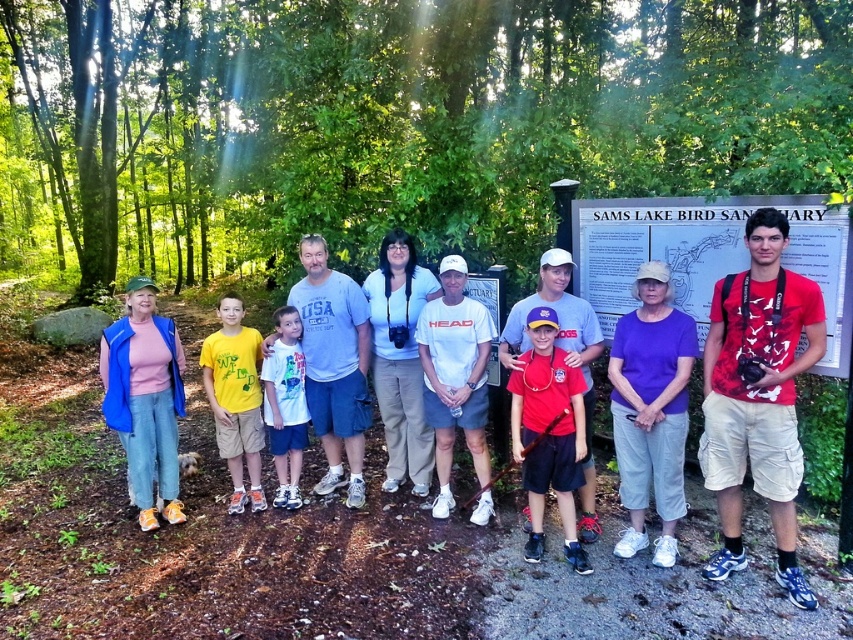
Is white paper sign at center above purple fabric cap at center?

Correct, white paper sign at center is located above purple fabric cap at center.

Is point (682, 298) less distant than point (561, 371)?

No, it is not.

At what (x,y) coordinates should I click in order to perform the action: click on white paper sign at center. Please return your answer as a coordinate pair (x, y). This screenshot has width=853, height=640. Looking at the image, I should click on (709, 256).

Who is shorter, yellow cotton shirt at center or white cotton shirt at center?

Standing shorter between the two is white cotton shirt at center.

Who is more forward, (252, 458) or (289, 342)?

Positioned in front is point (289, 342).

Locate an element on the screen. This screenshot has height=640, width=853. yellow cotton shirt at center is located at coordinates (235, 397).

What are the coordinates of `yellow cotton shirt at center` in the screenshot? It's located at (235, 397).

Which is in front, point (100, 97) or point (569, 408)?

Positioned in front is point (569, 408).

Who is taller, green leafy forest at upper center or purple fabric cap at center?

With more height is green leafy forest at upper center.

Find the location of a particular element. The width and height of the screenshot is (853, 640). green leafy forest at upper center is located at coordinates (415, 115).

Find the location of `green leafy forest at upper center`. green leafy forest at upper center is located at coordinates (415, 115).